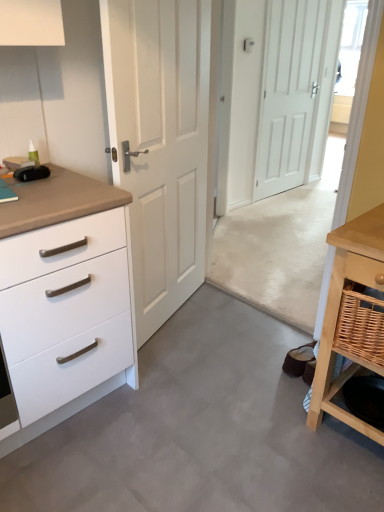
Locate an element on the screen. vacant area that lies between white matte chest of drawers at left and light wood table at lower right is located at coordinates (209, 422).